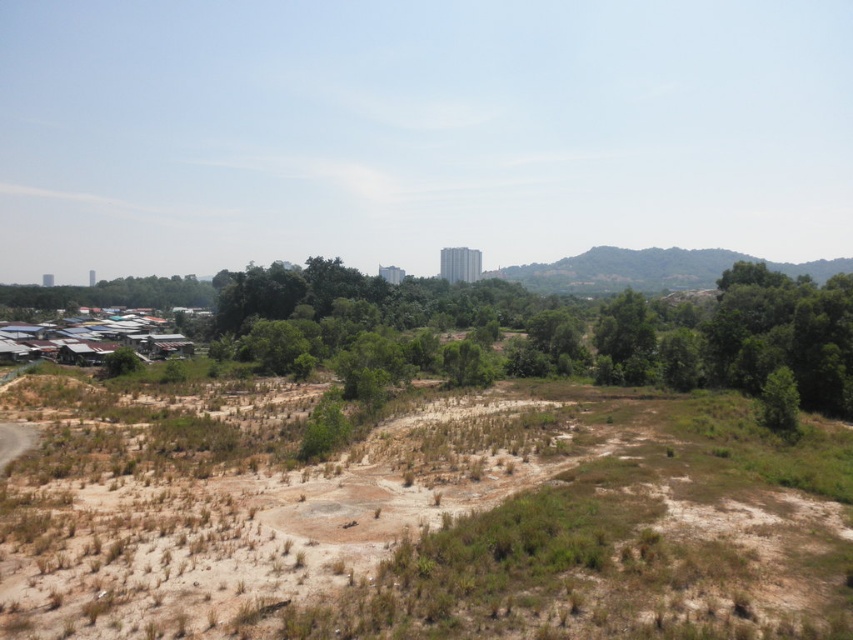
Is brown dry grass at center smaller than green grassy hillside at upper right?

Correct, brown dry grass at center occupies less space than green grassy hillside at upper right.

Looking at this image, who is taller, brown dry grass at center or green grassy hillside at upper right?

green grassy hillside at upper right is taller.

The height and width of the screenshot is (640, 853). I want to click on brown dry grass at center, so click(x=421, y=516).

Locate an element on the screen. The width and height of the screenshot is (853, 640). brown dry grass at center is located at coordinates (421, 516).

Is point (740, 291) behind point (550, 264)?

No, (740, 291) is closer to viewer.

You are a GUI agent. You are given a task and a screenshot of the screen. Output one action in this format:
    pyautogui.click(x=<x>, y=<y>)
    Task: Click on the green leafy tree at center
    
    Given the screenshot: What is the action you would take?
    pyautogui.click(x=572, y=326)

Measure the distance between brown dry grass at center and green leafy tree at center.

brown dry grass at center and green leafy tree at center are 59.60 meters apart.

Is brown dry grass at center to the left of green leafy tree at center from the viewer's perspective?

Result: Yes, brown dry grass at center is to the left of green leafy tree at center.

What do you see at coordinates (421, 516) in the screenshot? I see `brown dry grass at center` at bounding box center [421, 516].

At what (x,y) coordinates should I click in order to perform the action: click on brown dry grass at center. Please return your answer as a coordinate pair (x, y). Image resolution: width=853 pixels, height=640 pixels. Looking at the image, I should click on coord(421,516).